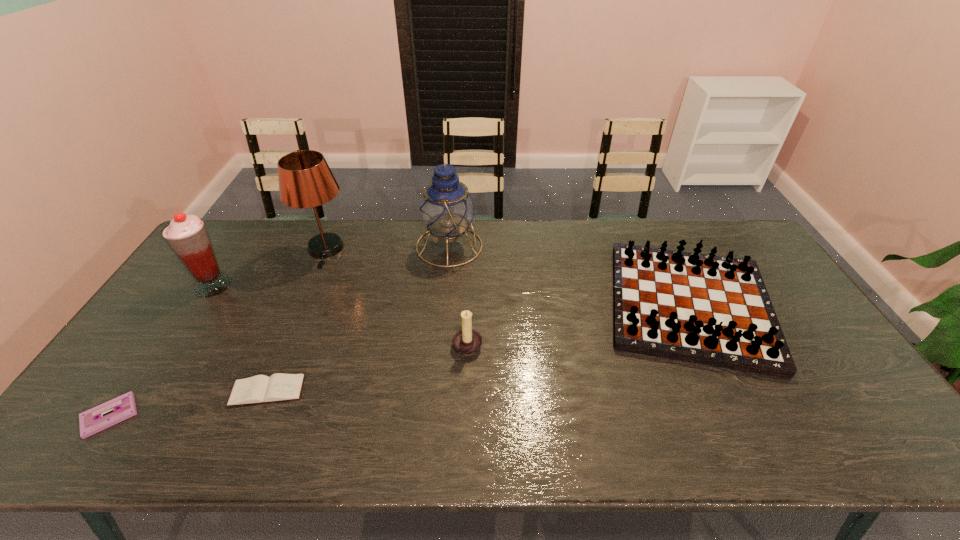
Image resolution: width=960 pixels, height=540 pixels. I want to click on vacant region located on the back of the third tallest object, so click(255, 220).

Find the location of a particular element. This screenshot has height=540, width=960. vacant space located on the wick of the candle holder is located at coordinates (551, 343).

Identify the location of vacant space located 0.120m on the front of the third shortest object. (747, 422).

Locate an element on the screen. The height and width of the screenshot is (540, 960). vacant region located on the left of the sixth tallest object is located at coordinates (131, 391).

Identify the location of vacant region located on the right of the videotape. This screenshot has width=960, height=540. (191, 416).

The height and width of the screenshot is (540, 960). What are the coordinates of `lampshade that is at the far edge` in the screenshot? It's located at (305, 180).

In order to click on lantern present at the far edge in this screenshot , I will do `click(447, 209)`.

I want to click on chessboard at the far edge, so click(x=706, y=309).

Where is `object that is at the near edge`? object that is at the near edge is located at coordinates (91, 421).

Locate an element on the screen. This screenshot has height=540, width=960. smoothie that is at the left edge is located at coordinates (187, 236).